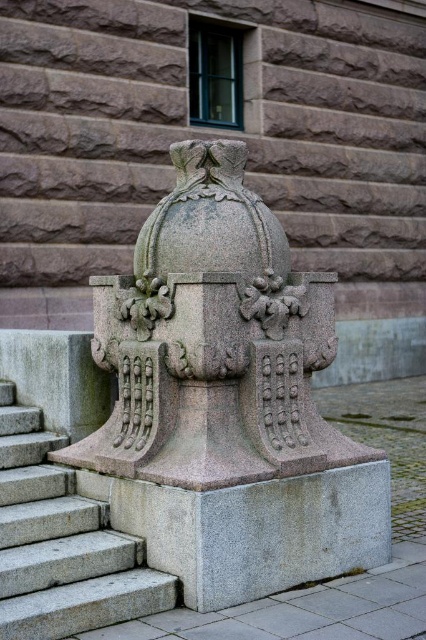
You are standing at the bottom of the gray granite stairs at lower left and want to reach the granite sculpture at center. Which direction should you move to get there?

The granite sculpture at center is to the right of gray granite stairs at lower left, so you should move to the right to reach it.

You are an architect planning to install a new decorative element in a courtyard. You have the granite sculpture at center and the gray granite stairs at lower left. Which object should you choose if you want to place a wider structure in the courtyard?

The granite sculpture at center should be chosen because its width is larger than the gray granite stairs at lower left, making it the wider option for the courtyard.